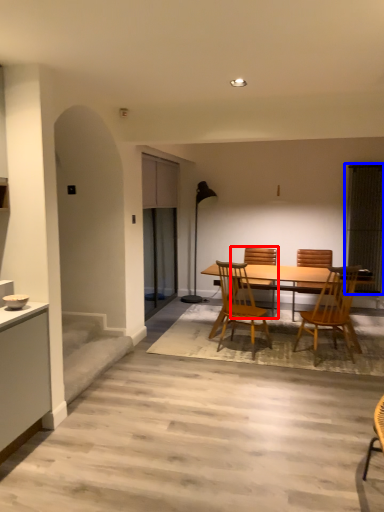
Question: Which point is further to the camera, chair (highlighted by a red box) or window screen (highlighted by a blue box)?

Choices:
 (A) chair
 (B) window screen

Answer: (B)